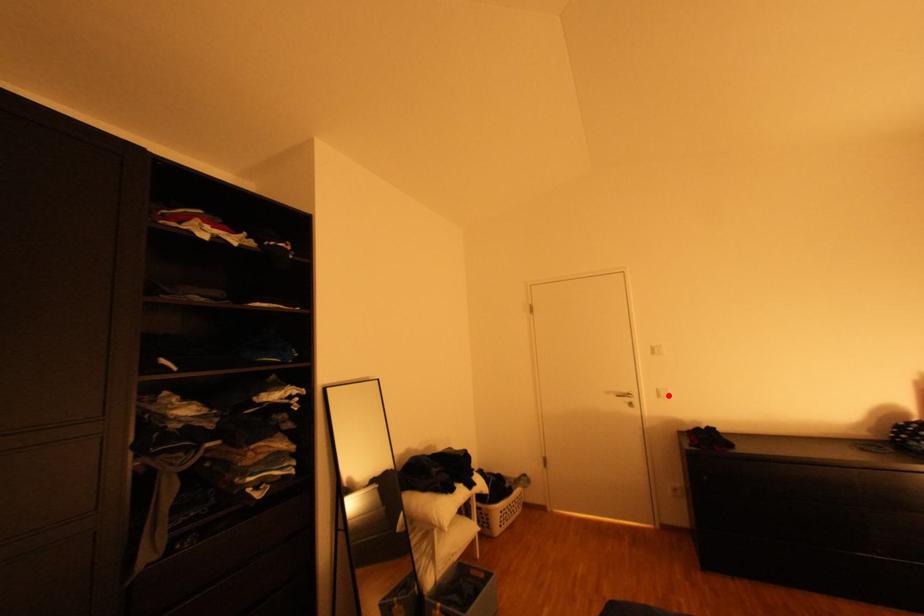
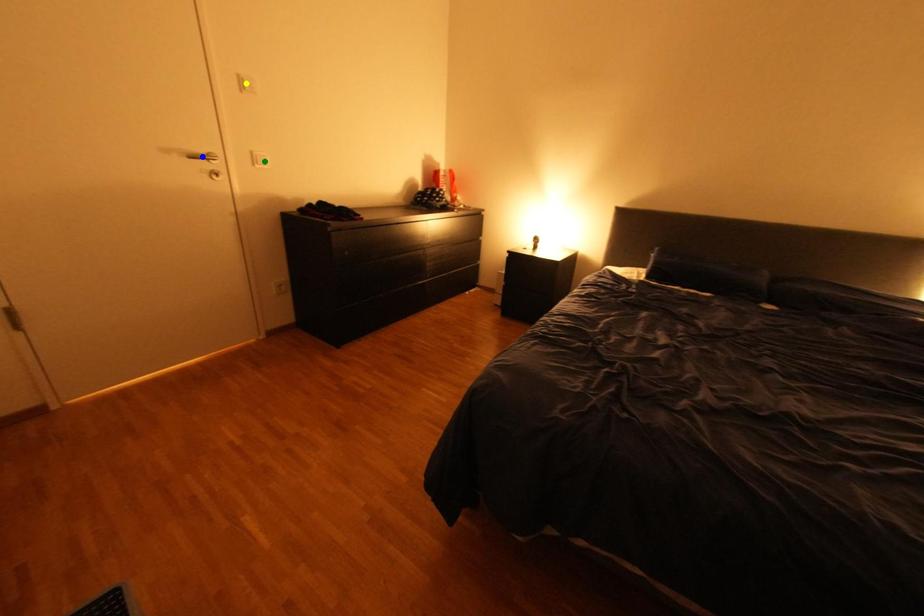
Question: I am providing you with two images of the same scene from different viewpoints. A red point is marked on the first image. You are given multiple points on the second image. Which mark in image 2 goes with the point in image 1?

Choices:
 (A) green point
 (B) yellow point
 (C) blue point

Answer: (A)